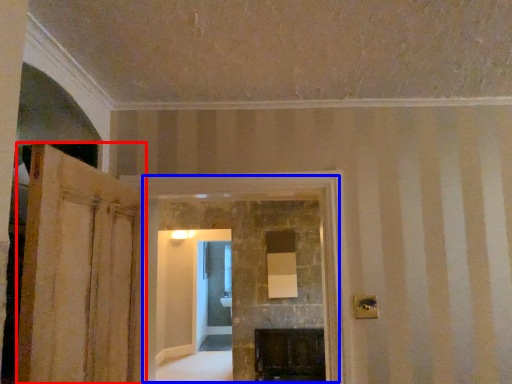
Question: Which object appears farthest to the camera in this image, door (highlighted by a red box) or fireplace (highlighted by a blue box)?

Choices:
 (A) door
 (B) fireplace

Answer: (B)